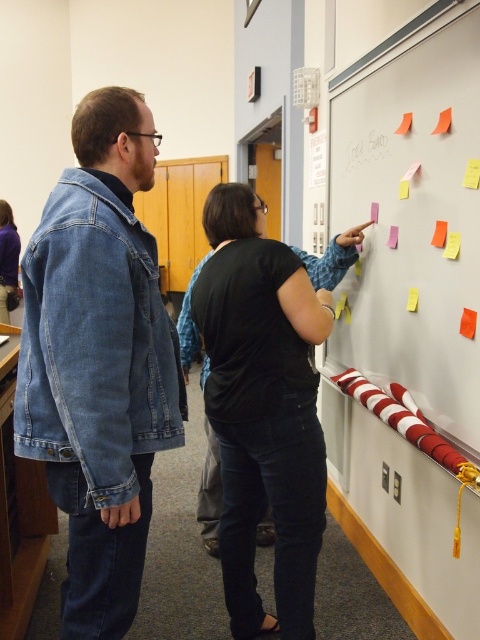
Question: Which of the following is the farthest from the observer?

Choices:
 (A) (94, 243)
 (B) (17, 253)

Answer: (B)

Question: Which of the following is the farthest from the observer?

Choices:
 (A) (283, 387)
 (B) (12, 234)
 (C) (349, 323)
 (D) (363, 136)

Answer: (B)

Question: Can you confirm if denim jacket at left is positioned to the right of black matte shirt at upper center?

Choices:
 (A) no
 (B) yes

Answer: (A)

Question: Which point appears closest to the camera in this image?

Choices:
 (A) (8, 253)
 (B) (22, 452)
 (C) (384, 275)

Answer: (B)

Question: Is multicolored sticky notes at upper right positioned behind black matte shirt at upper center?

Choices:
 (A) yes
 (B) no

Answer: (B)

Question: Can you confirm if black matte shirt at upper center is bigger than black matte shirt at center?

Choices:
 (A) yes
 (B) no

Answer: (A)